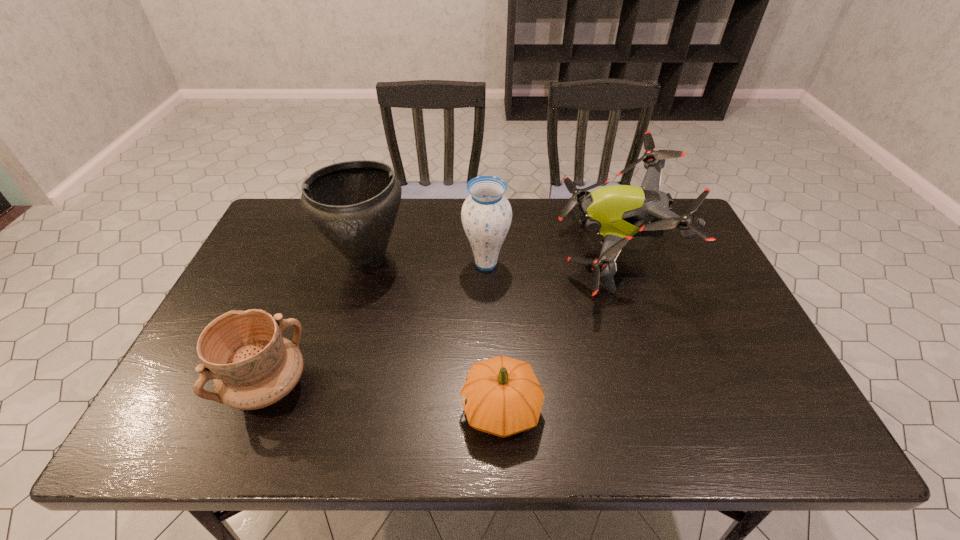
Find the location of a particular element. object that is at the near left corner is located at coordinates [252, 366].

Identify the location of object that is positioned at the far right corner. (617, 213).

The width and height of the screenshot is (960, 540). What are the coordinates of `vacant space at the far edge of the desktop` in the screenshot? It's located at (514, 221).

Locate an element on the screen. blank space at the near edge is located at coordinates (655, 427).

This screenshot has width=960, height=540. Find the location of `vacant region at the right edge of the desktop`. vacant region at the right edge of the desktop is located at coordinates (700, 363).

This screenshot has height=540, width=960. I want to click on vacant space at the near right corner of the desktop, so click(x=792, y=431).

Where is `free point between the urn and the gourd`? Image resolution: width=960 pixels, height=540 pixels. free point between the urn and the gourd is located at coordinates (434, 334).

This screenshot has height=540, width=960. I want to click on vacant space that's between the vase and the second shortest object, so click(377, 325).

Find the location of a particular element. This screenshot has width=960, height=540. free space between the urn and the gourd is located at coordinates (434, 334).

Locate an element on the screen. free spot between the rightmost object and the pottery is located at coordinates (441, 319).